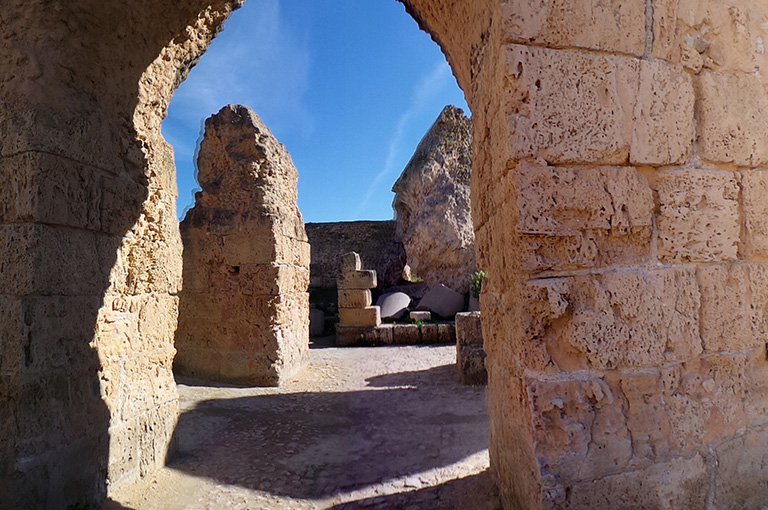
Image resolution: width=768 pixels, height=510 pixels. Find the location of `plant`. plant is located at coordinates (472, 280).